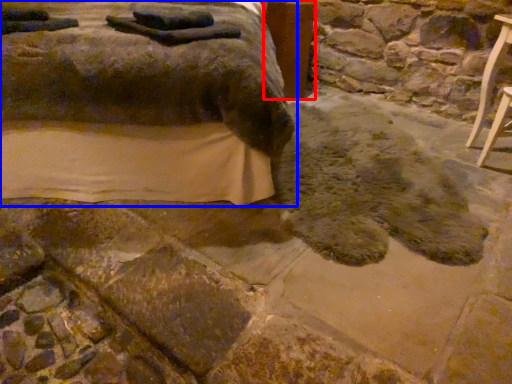
Question: Among these objects, which one is farthest to the camera, table (highlighted by a red box) or furniture (highlighted by a blue box)?

Choices:
 (A) table
 (B) furniture

Answer: (A)